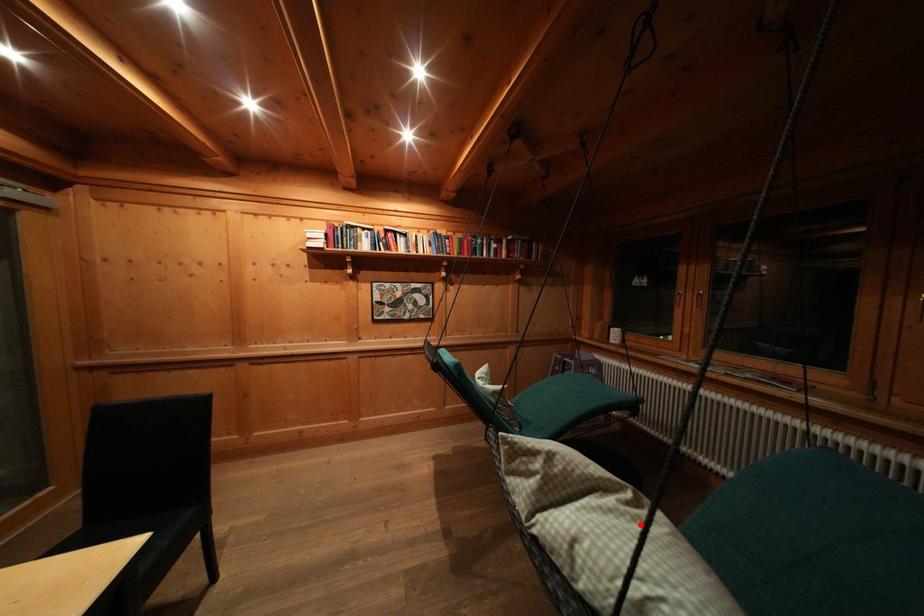
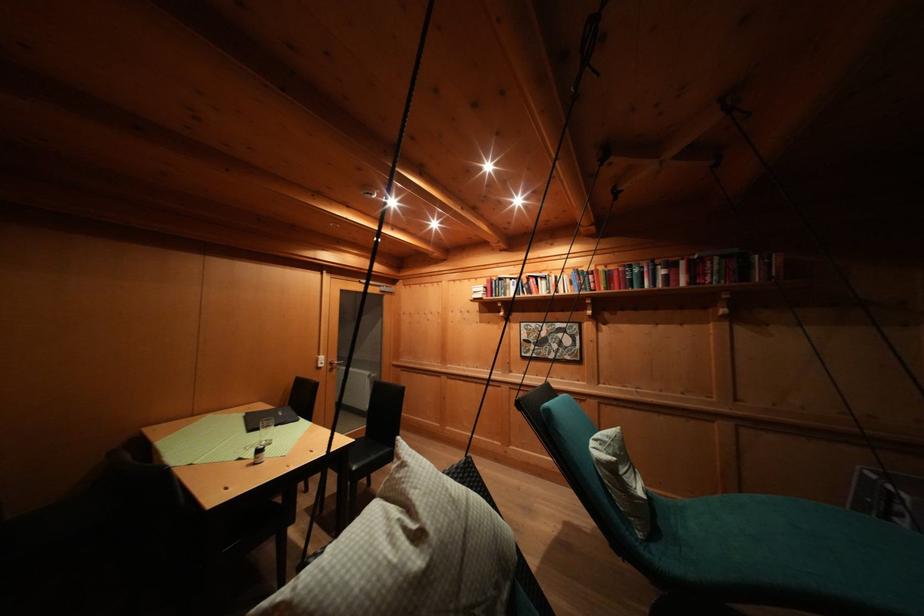
Where in the second image is the point corresponding to the highlighted location from the first image?

(396, 541)